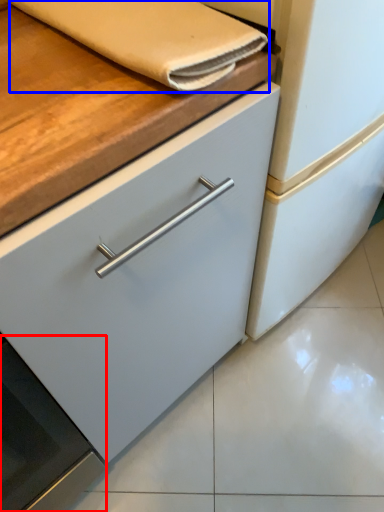
Question: Which of the following is the farthest to the observer, oven (highlighted by a red box) or hand towel (highlighted by a blue box)?

Choices:
 (A) oven
 (B) hand towel

Answer: (B)